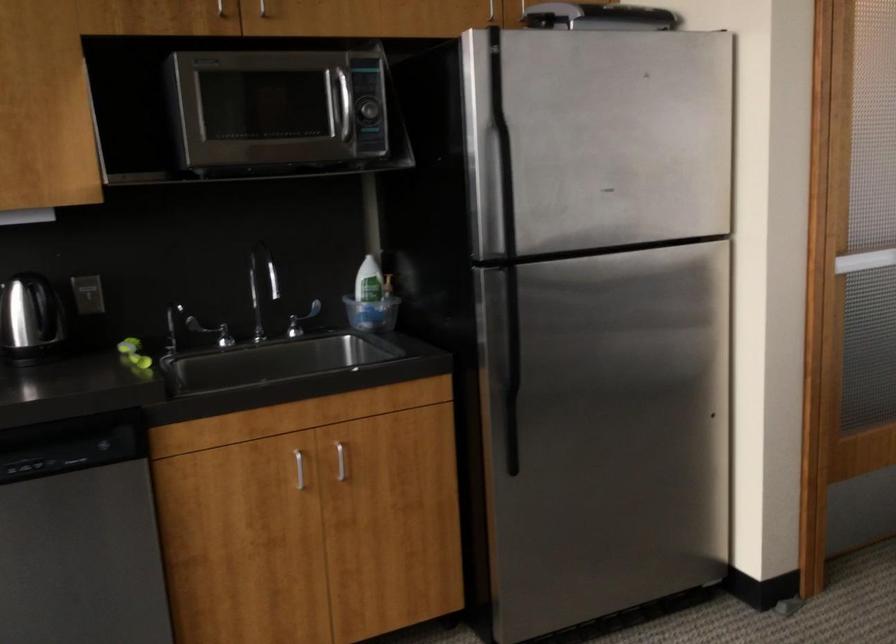
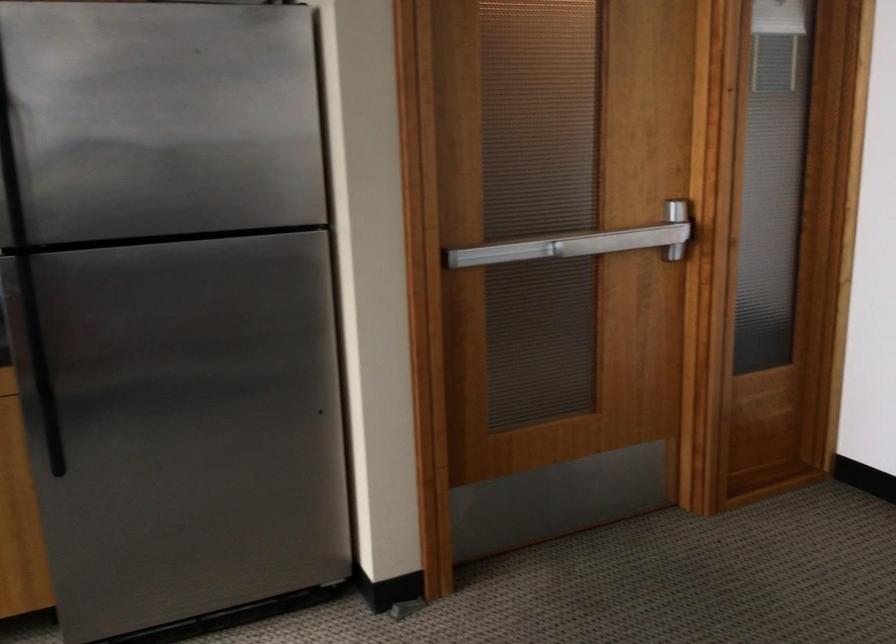
Question: What movement of the cameraman would produce the second image?

Choices:
 (A) Left
 (B) Right
 (C) Forward
 (D) Backward

Answer: (B)